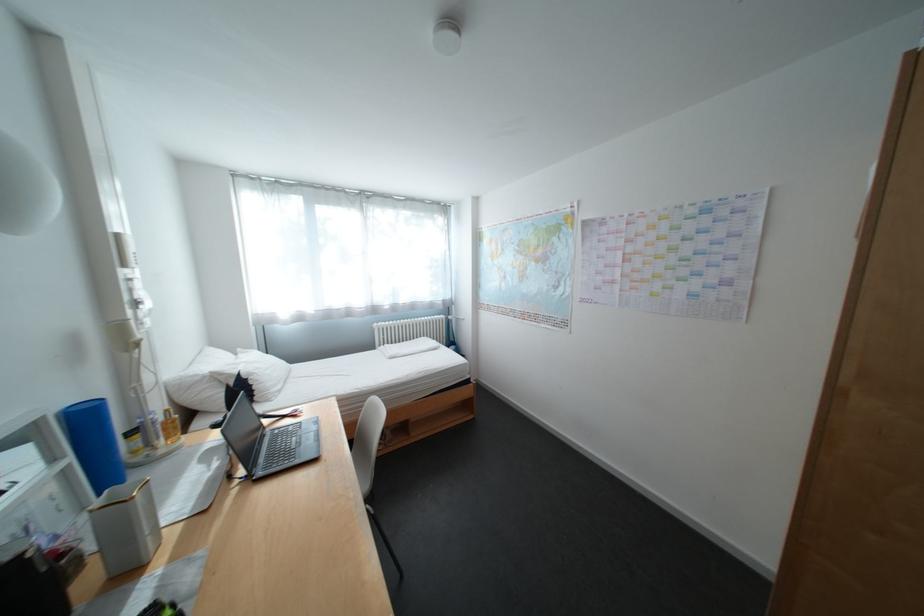
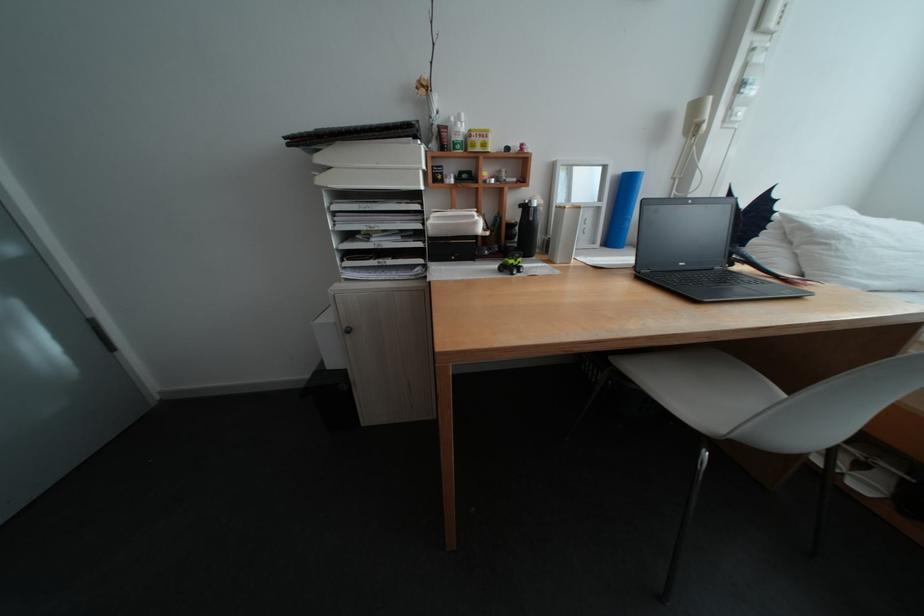
First-person continuous shooting, in which direction is the camera rotating?

The rotation direction of the camera is left-down.